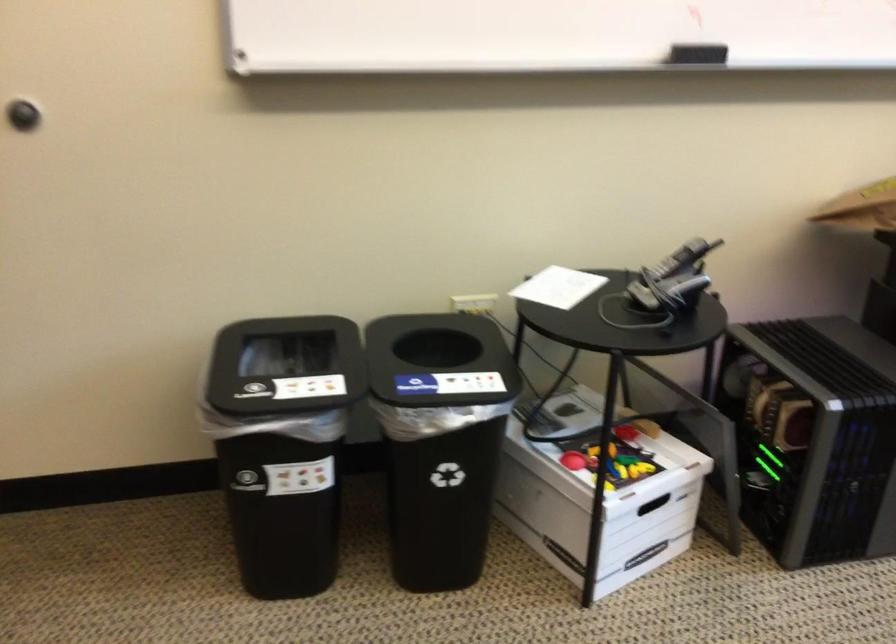
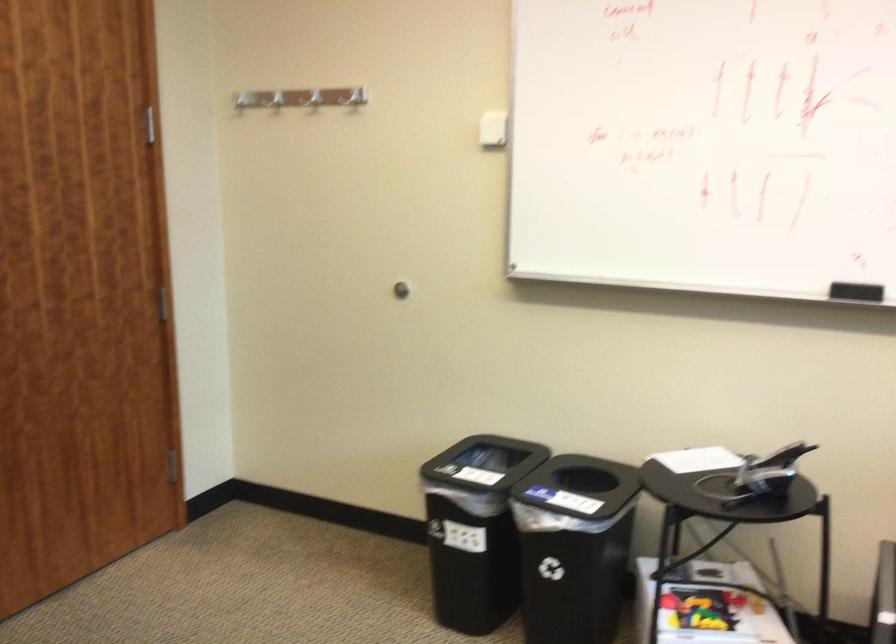
Locate, in the second image, the point that corresponds to pixel 616 456 in the first image.

(701, 609)